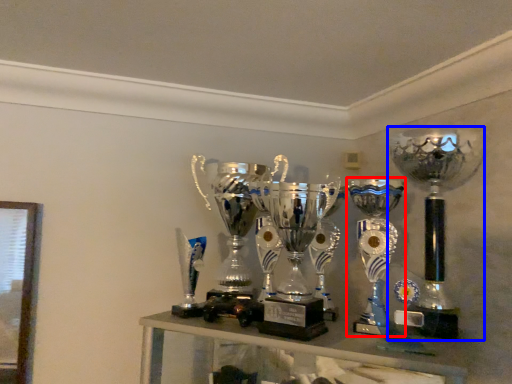
Question: Which object is further to the camera taking this photo, trophy (highlighted by a red box) or trophy (highlighted by a blue box)?

Choices:
 (A) trophy
 (B) trophy

Answer: (B)